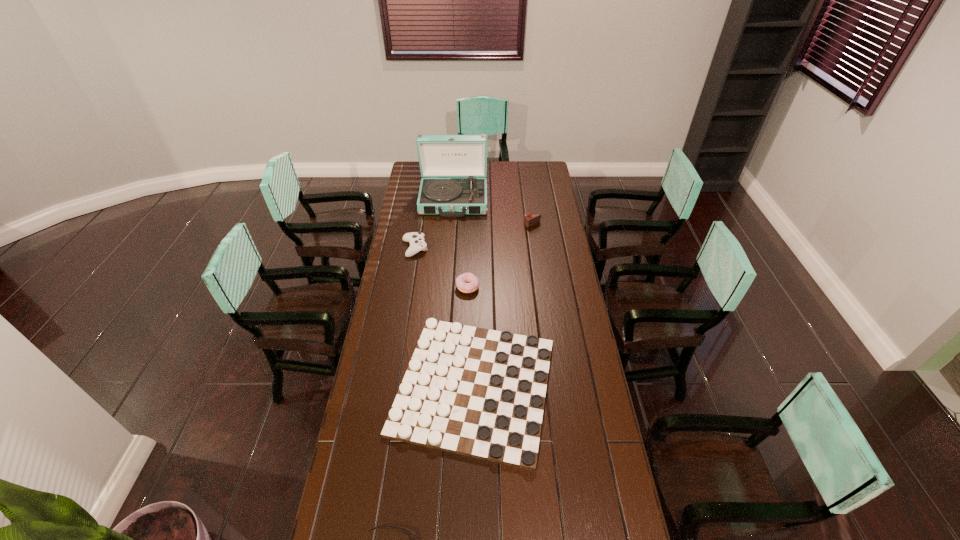
What are the coordinates of `vacant space located on the back of the fourth farthest object` in the screenshot? It's located at (468, 269).

At what (x,y) coordinates should I click in order to perform the action: click on free point located 0.070m on the back of the gameboard. Please return your answer as a coordinate pair (x, y). Looking at the image, I should click on (475, 309).

Locate an element on the screen. The width and height of the screenshot is (960, 540). record player that is at the left edge is located at coordinates (439, 155).

Where is `control present at the left edge`? Image resolution: width=960 pixels, height=540 pixels. control present at the left edge is located at coordinates (416, 239).

In order to click on gameboard at the left edge in this screenshot , I will do `click(477, 392)`.

Locate an element on the screen. Image resolution: width=960 pixels, height=540 pixels. chocolate cake present at the right edge is located at coordinates (530, 219).

At what (x,y) coordinates should I click in order to perform the action: click on gameboard positioned at the right edge. Please return your answer as a coordinate pair (x, y). This screenshot has height=540, width=960. Looking at the image, I should click on 477,392.

This screenshot has width=960, height=540. In the image, there is a desktop. Identify the location of vacant space at the left edge. (383, 449).

The image size is (960, 540). In the image, there is a desktop. Find the location of `vacant space at the right edge`. vacant space at the right edge is located at coordinates (566, 376).

Where is `unoccupied position between the gameboard and the fourth nearest object`? unoccupied position between the gameboard and the fourth nearest object is located at coordinates (444, 317).